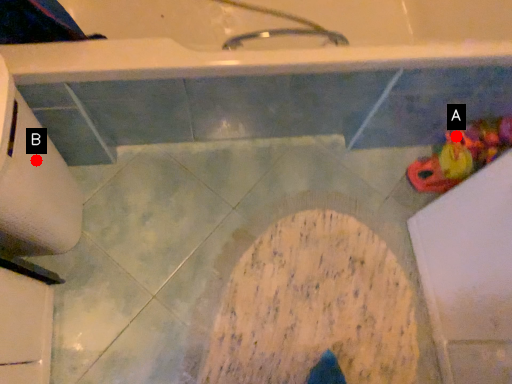
Question: Two points are circled on the image, labeled by A and B beside each circle. Which point appears farthest from the camera in this image?

Choices:
 (A) A is further
 (B) B is further

Answer: (A)